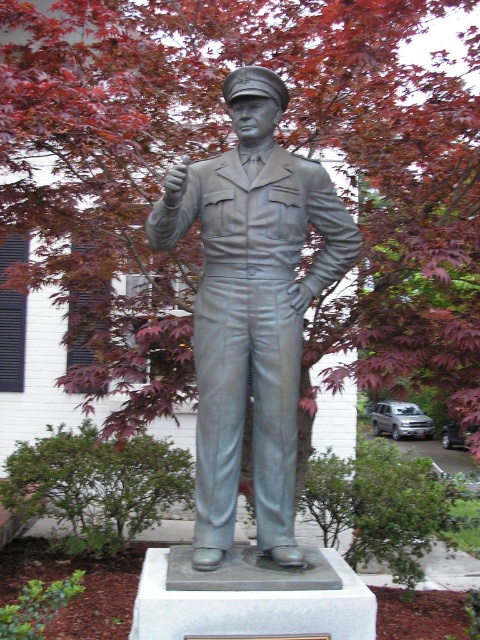
Where is `reddish-brown leaves at upper center`? reddish-brown leaves at upper center is located at coordinates (229, 147).

Can you confirm if reddish-brown leaves at upper center is shorter than bronze statue at center?

In fact, reddish-brown leaves at upper center may be taller than bronze statue at center.

Which is behind, point (51, 32) or point (278, 403)?

Positioned behind is point (51, 32).

Where is `reddish-brown leaves at upper center`? The height and width of the screenshot is (640, 480). reddish-brown leaves at upper center is located at coordinates tap(229, 147).